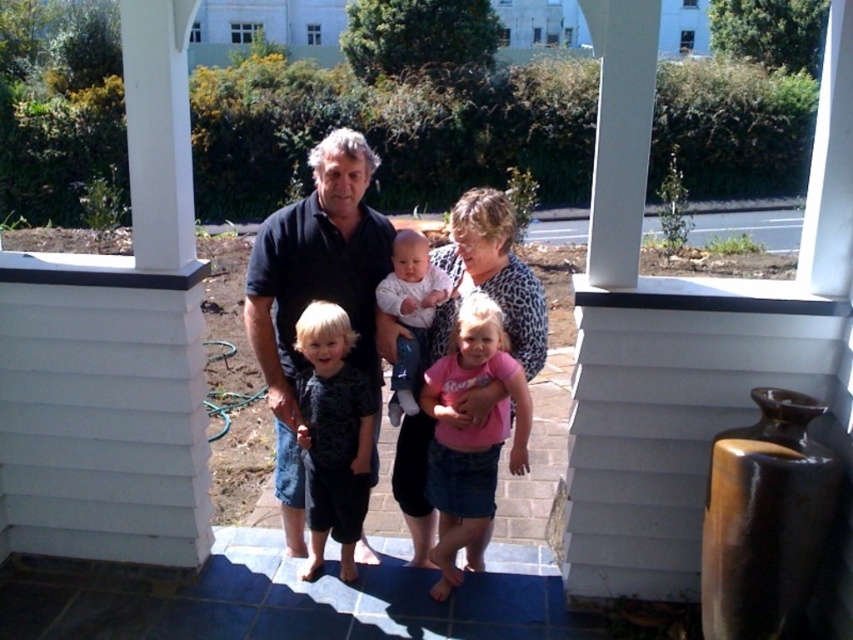
Does black cotton shirt at center lie behind white cotton baby at center?

That is False.

Can you confirm if black cotton shirt at center is thinner than white cotton baby at center?

No, black cotton shirt at center is not thinner than white cotton baby at center.

Who is more forward, (306,211) or (427,300)?

Point (427,300) is more forward.

At what (x,y) coordinates should I click in order to perform the action: click on black cotton shirt at center. Please return your answer as a coordinate pair (x, y). The width and height of the screenshot is (853, 640). Looking at the image, I should click on (316, 294).

Between pink denim skirt at center and white cotton baby at center, which one has more height?

Standing taller between the two is pink denim skirt at center.

Does pink denim skirt at center have a lesser width compared to white cotton baby at center?

In fact, pink denim skirt at center might be wider than white cotton baby at center.

Between point (440, 403) and point (402, 273), which one is positioned behind?

Point (402, 273)

I want to click on pink denim skirt at center, so click(x=469, y=433).

Does dark gray textured shirt at center have a greater width compared to white cotton baby at center?

Indeed, dark gray textured shirt at center has a greater width compared to white cotton baby at center.

Is dark gray textured shirt at center above white cotton baby at center?

Actually, dark gray textured shirt at center is below white cotton baby at center.

Is point (323, 403) behind point (393, 276)?

No, (323, 403) is closer to viewer.

Where is `dark gray textured shirt at center`? dark gray textured shirt at center is located at coordinates (334, 435).